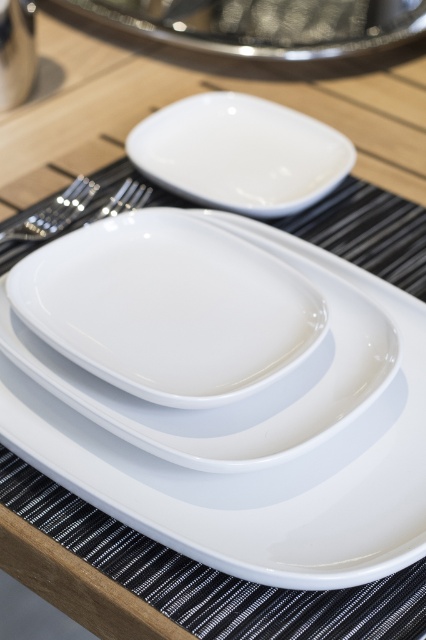
You are setting up a table for a dinner party and need to place a decorative centerpiece. The glossy ceramic plate at center and the white glossy platter at center are both on the table. Which object should you move to make space for the centerpiece?

You should move the glossy ceramic plate at center because it is in front of the white glossy platter at center, meaning it is closer to the front of the table where the centerpiece would typically be placed.

You are a chef arranging dishes on a table. You have a glossy ceramic plate at center and a white glossy platter at center. Can you place a 3 inch long spoon between them without touching either?

The distance between the glossy ceramic plate at center and the white glossy platter at center is 2.65 inches. Since the spoon is 3 inches long, it cannot fit between them without touching either.

You are setting up a table and need to place a napkin on the largest plate. Which one should you choose between the glossy ceramic plate at center and the white glossy platter at center?

The glossy ceramic plate at center is wider than the white glossy platter at center, so you should place the napkin on the glossy ceramic plate at center.